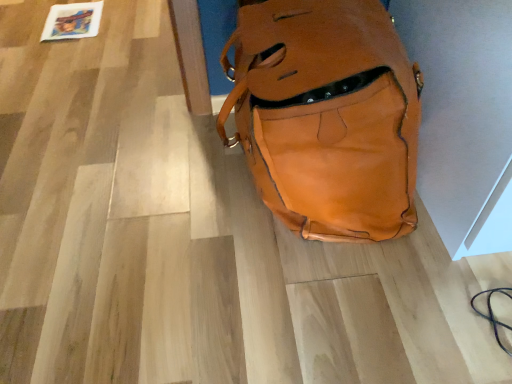
The image size is (512, 384). Describe the element at coordinates (326, 116) in the screenshot. I see `matte brown leather backpack at center` at that location.

This screenshot has height=384, width=512. I want to click on matte brown leather backpack at center, so click(x=326, y=116).

The height and width of the screenshot is (384, 512). I want to click on matte brown leather backpack at center, so click(326, 116).